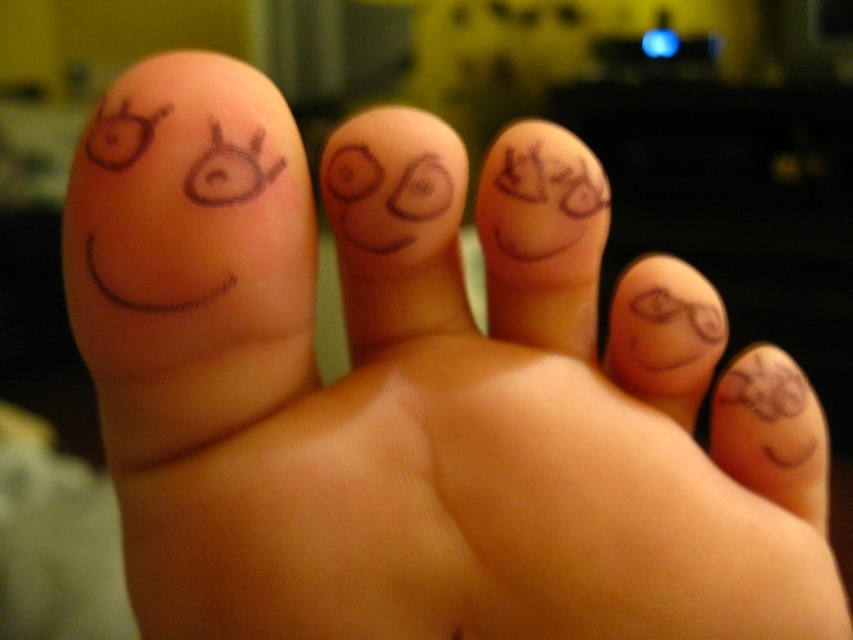
Question: Which object is positioned farthest from the matte black toe at center?

Choices:
 (A) brown ink drawing at left
 (B) matte black toe at upper center
 (C) matte black smiley face at lower right
 (D) smooth skin at lower right

Answer: (C)

Question: Can you confirm if matte black toe at upper center is positioned to the left of matte black smiley face at lower right?

Choices:
 (A) no
 (B) yes

Answer: (B)

Question: Estimate the real-world distances between objects in this image. Which object is closer to the matte black toe at upper center?

Choices:
 (A) matte black toe at center
 (B) brown ink drawing at left
 (C) smooth skin at lower right
 (D) matte black smiley face at lower right

Answer: (A)

Question: Is matte black toe at upper center closer to camera compared to matte black toe at center?

Choices:
 (A) yes
 (B) no

Answer: (B)

Question: Does matte black toe at center come in front of matte black smiley face at lower right?

Choices:
 (A) yes
 (B) no

Answer: (A)

Question: Considering the real-world distances, which object is closest to the brown ink drawing at left?

Choices:
 (A) matte black toe at upper center
 (B) matte black smiley face at lower right
 (C) smooth skin at lower right

Answer: (A)